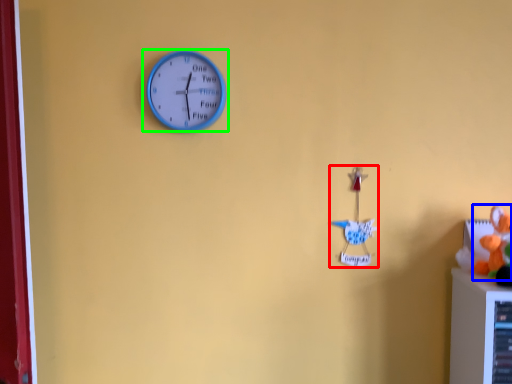
Question: Which object is positioned closest to toy (highlighted by a red box)? Select from toy (highlighted by a blue box) and wall clock (highlighted by a green box).

Choices:
 (A) toy
 (B) wall clock

Answer: (A)